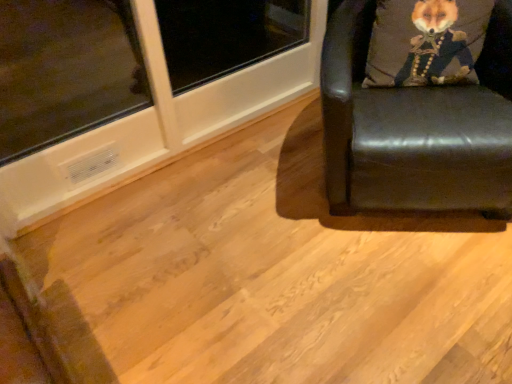
Question: From the image's perspective, is black leather chair at right located beneath velvet fox head at upper right?

Choices:
 (A) yes
 (B) no

Answer: (A)

Question: Is black leather chair at right oriented towards velvet fox head at upper right?

Choices:
 (A) yes
 (B) no

Answer: (B)

Question: Considering the relative sizes of black leather chair at right and velvet fox head at upper right in the image provided, is black leather chair at right bigger than velvet fox head at upper right?

Choices:
 (A) yes
 (B) no

Answer: (A)

Question: Is black leather chair at right taller than velvet fox head at upper right?

Choices:
 (A) no
 (B) yes

Answer: (B)

Question: Considering the relative positions of black leather chair at right and velvet fox head at upper right in the image provided, is black leather chair at right to the left of velvet fox head at upper right from the viewer's perspective?

Choices:
 (A) no
 (B) yes

Answer: (B)

Question: Considering the relative positions of black leather chair at right and velvet fox head at upper right in the image provided, is black leather chair at right to the right of velvet fox head at upper right from the viewer's perspective?

Choices:
 (A) yes
 (B) no

Answer: (B)

Question: Considering the relative sizes of velvet fox head at upper right and black leather chair at right in the image provided, is velvet fox head at upper right smaller than black leather chair at right?

Choices:
 (A) yes
 (B) no

Answer: (A)

Question: From the image's perspective, does velvet fox head at upper right appear higher than black leather chair at right?

Choices:
 (A) yes
 (B) no

Answer: (A)

Question: From a real-world perspective, does velvet fox head at upper right sit lower than black leather chair at right?

Choices:
 (A) no
 (B) yes

Answer: (A)

Question: Is velvet fox head at upper right at the right side of black leather chair at right?

Choices:
 (A) no
 (B) yes

Answer: (B)

Question: Can you confirm if velvet fox head at upper right is wider than black leather chair at right?

Choices:
 (A) yes
 (B) no

Answer: (B)

Question: Can you confirm if velvet fox head at upper right is shorter than black leather chair at right?

Choices:
 (A) no
 (B) yes

Answer: (B)

Question: Based on their sizes in the image, would you say black leather chair at right is bigger or smaller than velvet fox head at upper right?

Choices:
 (A) big
 (B) small

Answer: (A)